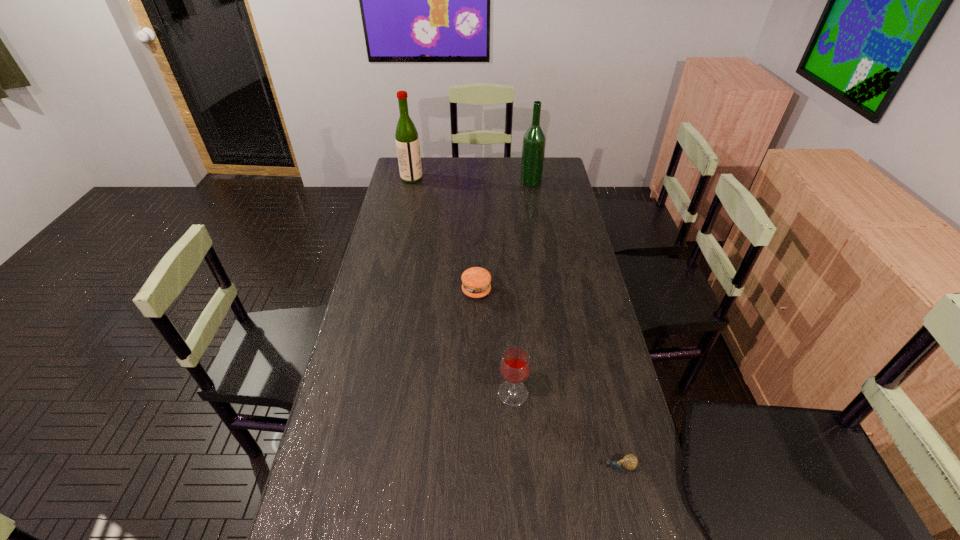
What are the coordinates of `the leftmost object` in the screenshot? It's located at (407, 141).

Image resolution: width=960 pixels, height=540 pixels. What are the coordinates of `alcohol` in the screenshot? It's located at (534, 140).

At what (x,y) coordinates should I click in order to perform the action: click on the second nearest object. Please return your answer as a coordinate pair (x, y). Looking at the image, I should click on (515, 365).

Locate an element on the screen. This screenshot has width=960, height=540. the third tallest object is located at coordinates (515, 365).

This screenshot has width=960, height=540. In order to click on the third farthest object in this screenshot , I will do `click(476, 281)`.

Where is `the fourth tallest object`? This screenshot has height=540, width=960. the fourth tallest object is located at coordinates (476, 281).

Image resolution: width=960 pixels, height=540 pixels. I want to click on escargot, so click(x=629, y=462).

Locate an element on the screen. The image size is (960, 540). the nearest object is located at coordinates (629, 462).

You are a GUI agent. You are given a task and a screenshot of the screen. Output one action in this format:
    pyautogui.click(x=<x>, y=<y>)
    Task: Click on the vacant space located on the label of the leftmost object
    The height and width of the screenshot is (540, 960).
    Given the screenshot: What is the action you would take?
    pos(502,179)

I want to click on vacant area situated on the front of the alcohol, so click(x=537, y=220).